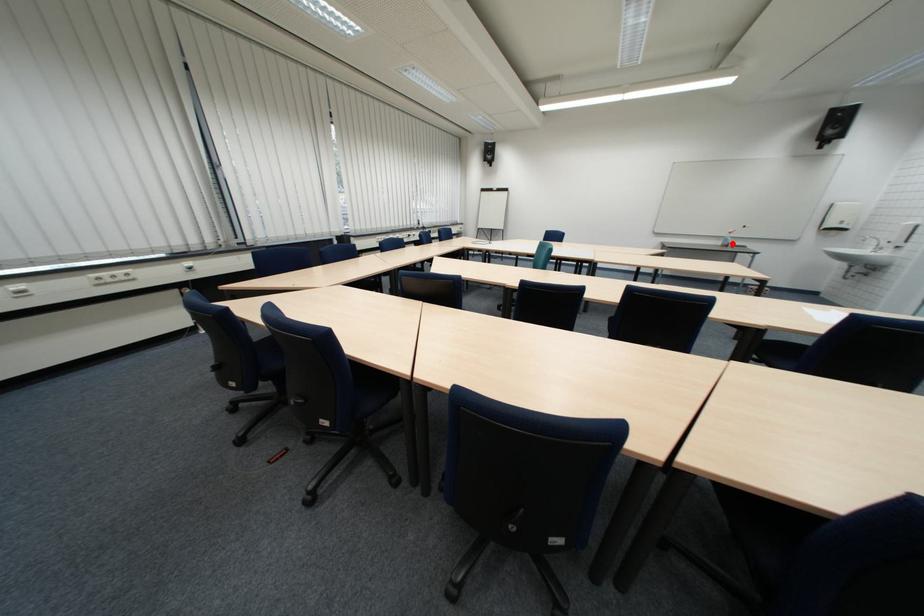
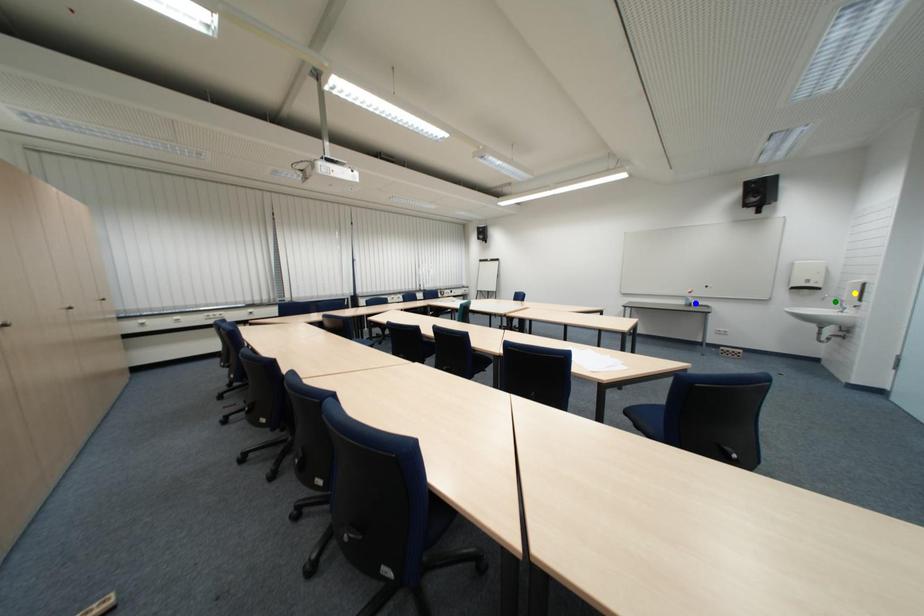
Question: I am providing you with two images of the same scene from different viewpoints. A red point is marked on the first image. You are given multiple points on the second image. Which mark in image 2 goes with the point in image 1?

Choices:
 (A) yellow point
 (B) green point
 (C) blue point

Answer: (C)